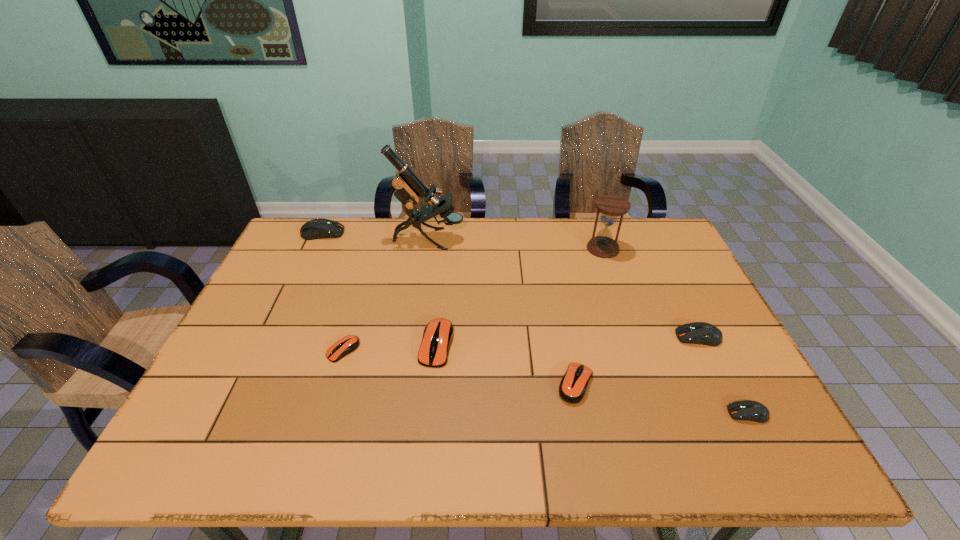
Image resolution: width=960 pixels, height=540 pixels. I want to click on vacant space situated 0.280m on the right of the second biggest orange computer mouse, so click(x=712, y=384).

Image resolution: width=960 pixels, height=540 pixels. In order to click on blank area located 0.210m on the button of the nearest dark computer equipment in this screenshot , I will do [635, 414].

I want to click on vacant space located 0.240m on the button of the nearest dark computer equipment, so click(621, 414).

At what (x,y) coordinates should I click in order to perform the action: click on vacant space located on the button of the nearest dark computer equipment. Please return your answer as a coordinate pair (x, y). The image size is (960, 540). Looking at the image, I should click on (595, 414).

You are a GUI agent. You are given a task and a screenshot of the screen. Output one action in this format:
    pyautogui.click(x=<x>, y=<y>)
    Task: Click on the vacant space located on the right of the shortest computer mouse
    This screenshot has width=960, height=540.
    Given the screenshot: What is the action you would take?
    pyautogui.click(x=429, y=350)

Identify the location of microscope that is positioned at the far edge. Image resolution: width=960 pixels, height=540 pixels. (409, 187).

Find the location of `hourglass that is at the far edge`. hourglass that is at the far edge is located at coordinates (611, 206).

I want to click on computer equipment located at the far edge, so click(320, 228).

Where is `object located in the left edge section of the desktop`? This screenshot has width=960, height=540. object located in the left edge section of the desktop is located at coordinates (320, 228).

At what (x,y) coordinates should I click in order to perform the action: click on object located at the far left corner. Please return your answer as a coordinate pair (x, y). Image resolution: width=960 pixels, height=540 pixels. Looking at the image, I should click on (320, 228).